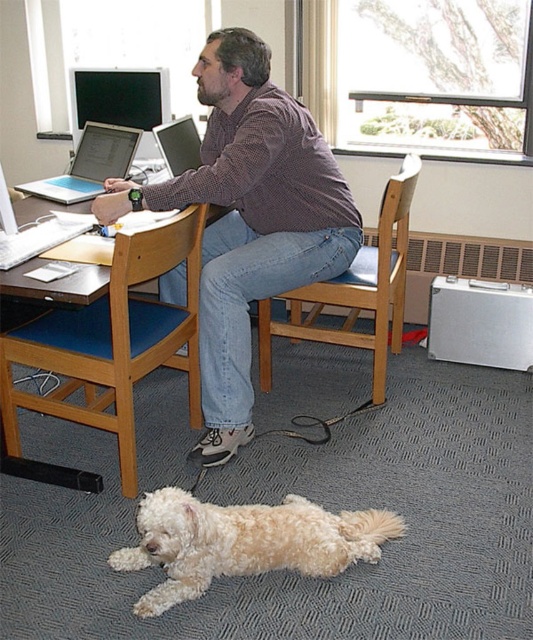
You are a delivery robot that needs to place a package on the desk in the image. The desk is at the center of the room. There is a white fluffy dog at lower center. To avoid stepping on the dog, where should you place the package?

The white fluffy dog at lower center is located at point (244, 541). To avoid stepping on the dog, the package should be placed away from this coordinate on the desk.

You are a delivery person entering the office and need to hand over a package to the person wearing the matte brown shirt at center. The desk has a matte black monitor at upper left. Where should you approach to deliver the package?

The matte brown shirt at center is in front of the matte black monitor at upper left, so you should approach the area in front of the matte black monitor at upper left to deliver the package to the person wearing the matte brown shirt at center.